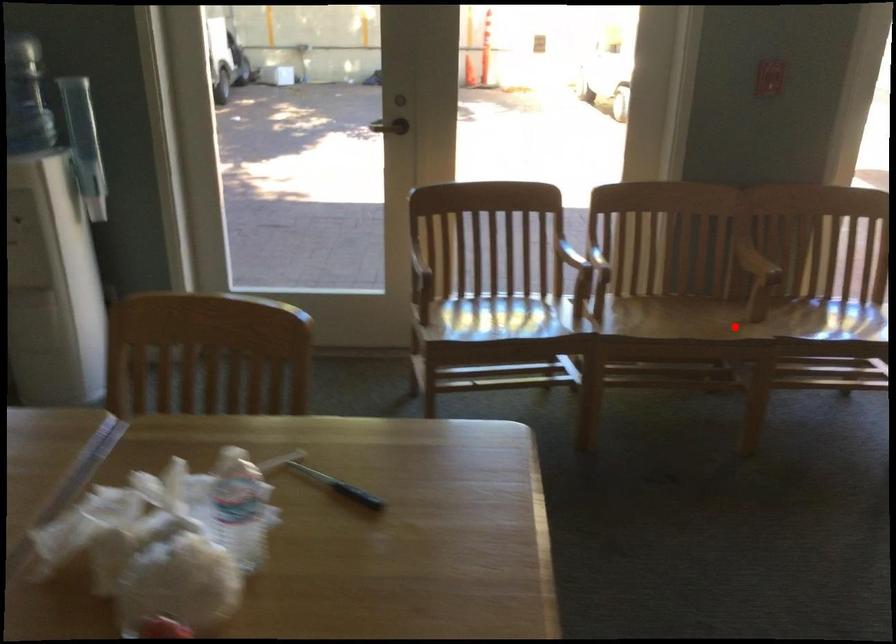
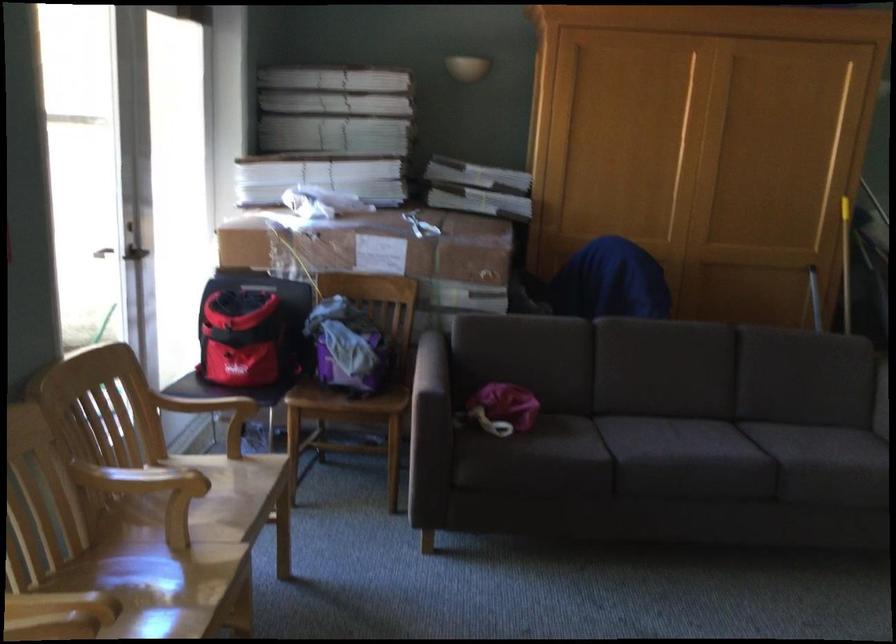
Find the pixel in the second image that matches the highlighted location in the first image.

(169, 590)